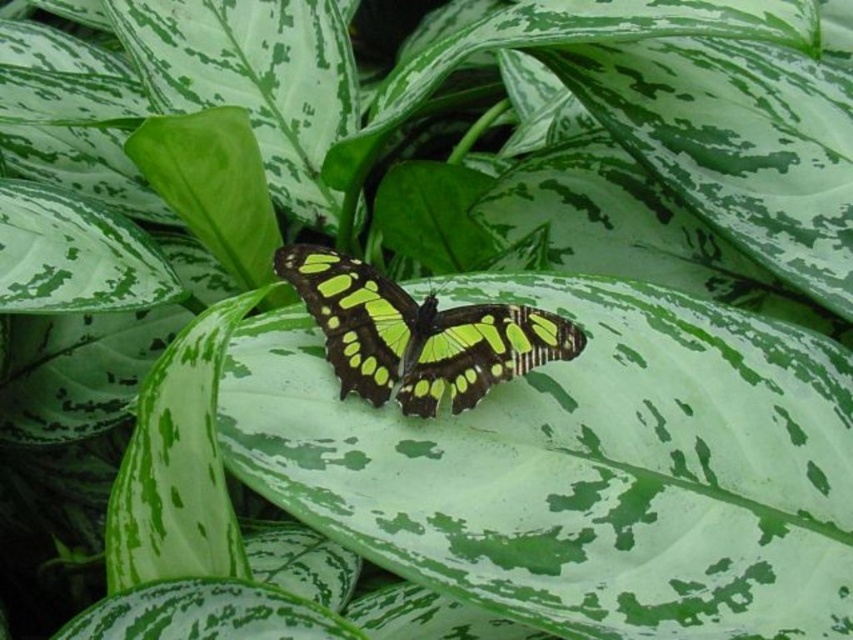
Can you confirm if green matte leaf at center is positioned above green iridescent wings at center?

Actually, green matte leaf at center is below green iridescent wings at center.

Measure the distance between green matte leaf at center and camera.

green matte leaf at center is 77.99 centimeters away from camera.

Identify the location of green matte leaf at center. (579, 467).

The width and height of the screenshot is (853, 640). In order to click on green matte leaf at center in this screenshot , I will do `click(579, 467)`.